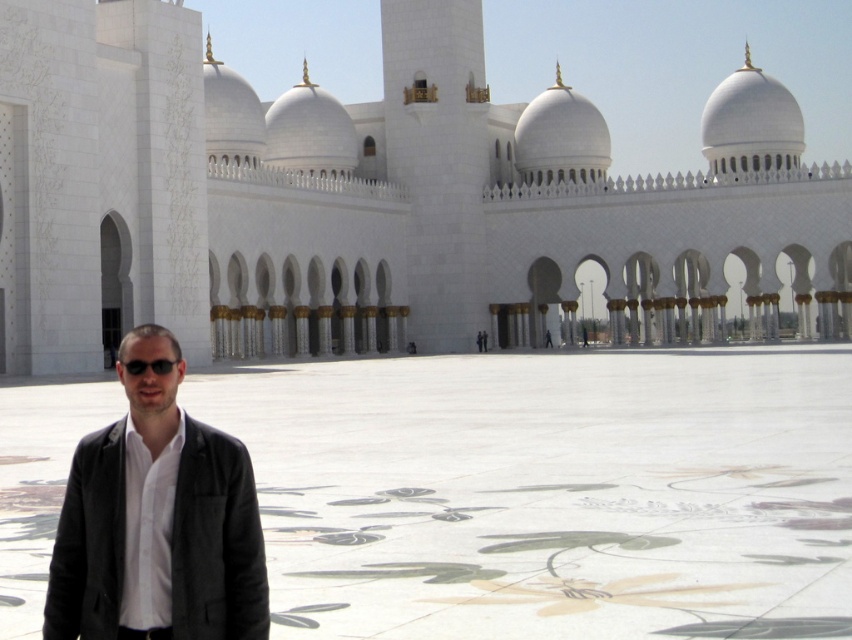
You are standing at the point closer to the camera in the image. Which point are you at, point (199,481) or point (158,365)?

You are at point (199,481) because it is in front of point (158,365), meaning it is closer to the camera.

You are standing at the entrance of the mosque and want to take a photo of the white marble courtyard at center. Which direction should you face to capture it in your shot?

You should face towards the center of the mosque to capture the white marble courtyard at center in your shot.

You are standing in the courtyard of the mosque and see a man wearing a dark gray blazer at left. If you want to approach him, how many steps would you need to take to reach him, assuming each step covers approximately 3 feet?

The dark gray blazer at left is 19.92 feet away from the viewer. Since each step covers about 3 feet, you would need approximately 7 steps to reach him.